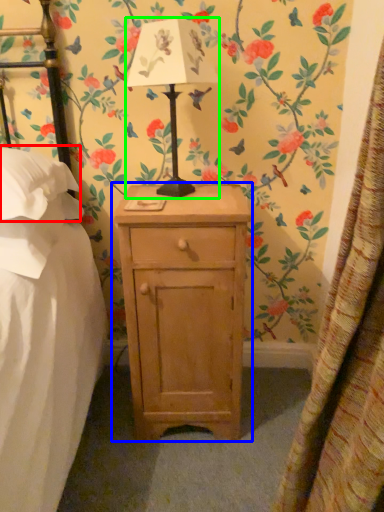
Question: Estimate the real-world distances between objects in this image. Which object is closer to pillow (highlighted by a red box), nightstand (highlighted by a blue box) or table lamp (highlighted by a green box)?

Choices:
 (A) nightstand
 (B) table lamp

Answer: (B)